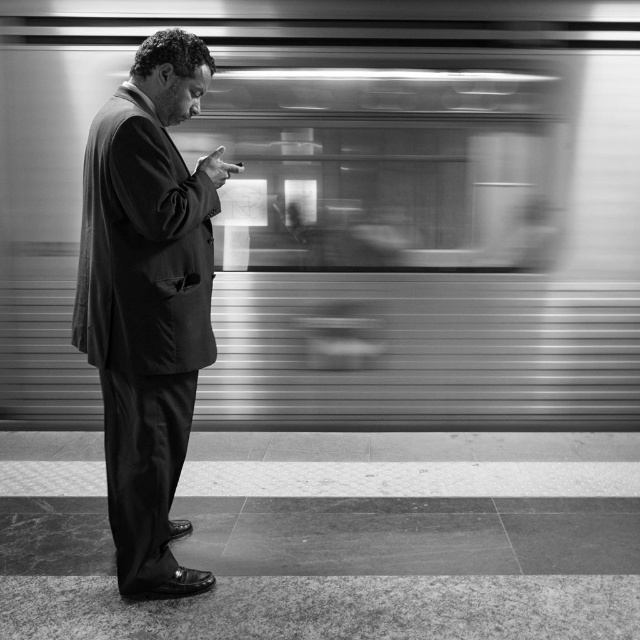
Based on the scene description, where is the metallic silver train at center located in the image?

The metallic silver train at center is located at point coordinates of 0.320 on the x axis and 0.556 on the y axis.

In the subway station scene, there is a metallic silver train at center and a smooth suit at center. Which object is positioned to the right of the other?

The metallic silver train at center is to the right of the smooth suit at center.